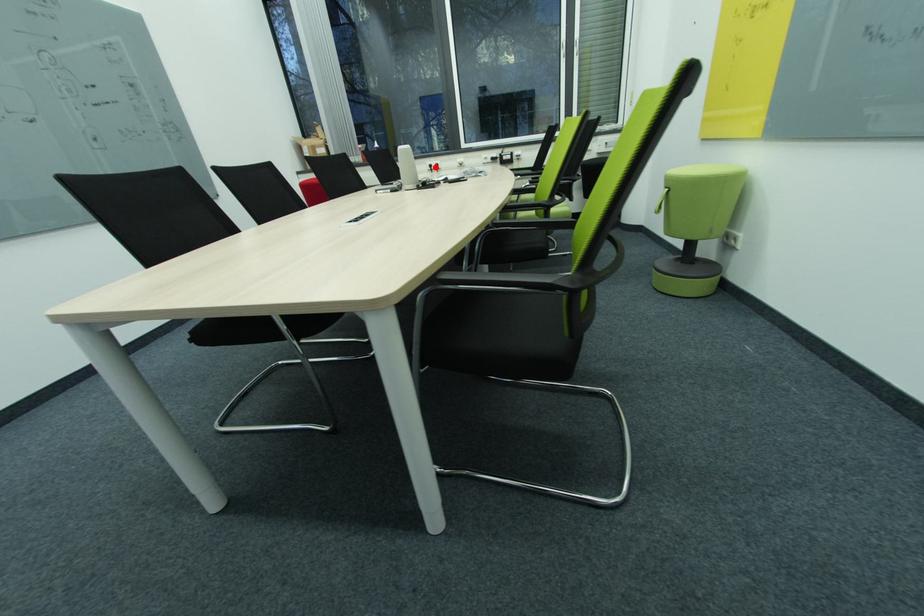
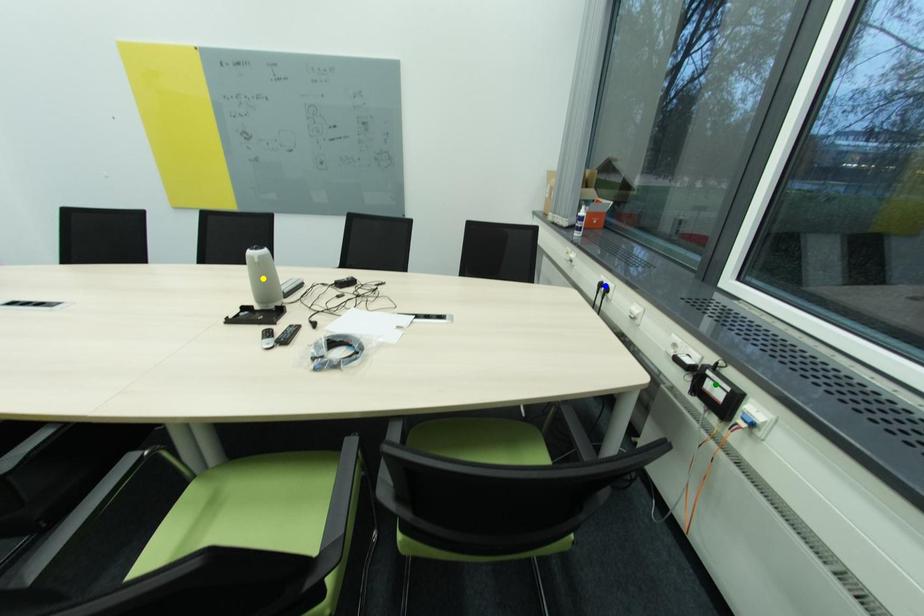
Question: I am providing you with two images of the same scene from different viewpoints. A red point is marked on the first image. You are given multiple points on the second image. Which spot in image 2 lines up with the point in image 1?

Choices:
 (A) blue point
 (B) yellow point
 (C) green point

Answer: (A)